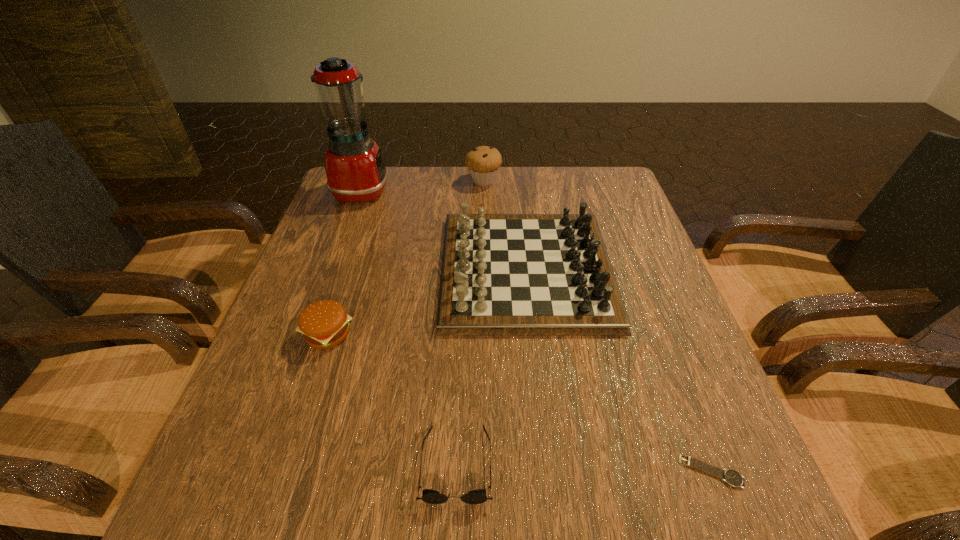
At what (x,y) coordinates should I click in order to perform the action: click on vacant area that satisfies the following two spatial constraints: 1. on the controls of the food processor; 2. on the left side of the rightmost object. Please return your answer as a coordinate pair (x, y). The image size is (960, 540). Looking at the image, I should click on (259, 471).

Identify the location of vacant space that satisfies the following two spatial constraints: 1. on the controls of the food processor; 2. on the right side of the shortest object. The height and width of the screenshot is (540, 960). (259, 471).

The height and width of the screenshot is (540, 960). Find the location of `free space that satisfies the following two spatial constraints: 1. on the front-facing side of the shortest object; 2. on the left side of the sunglasses`. free space that satisfies the following two spatial constraints: 1. on the front-facing side of the shortest object; 2. on the left side of the sunglasses is located at coordinates (456, 471).